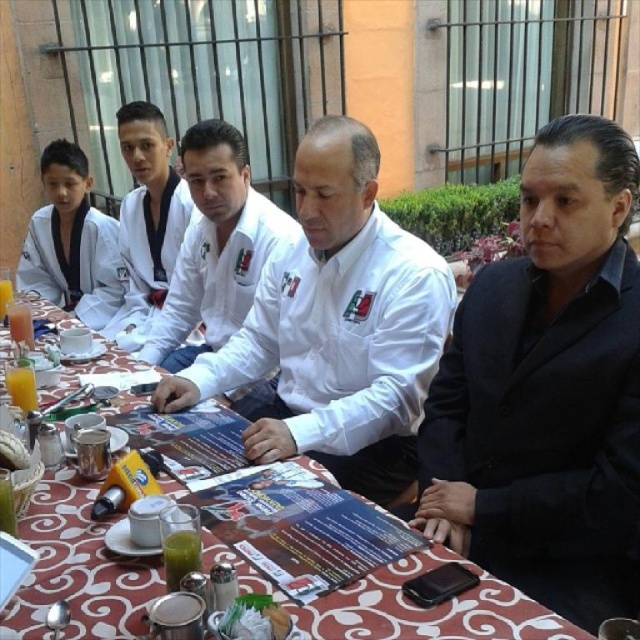
Question: Which point is farther to the camera?

Choices:
 (A) (4, 296)
 (B) (67, 525)
 (C) (364, 234)
 (D) (115, 300)

Answer: (D)

Question: Can you confirm if patterned fabric table at center is smaller than white cotton karate uniform at left?

Choices:
 (A) no
 (B) yes

Answer: (B)

Question: Does black smooth suit at right have a smaller size compared to white cotton karate uniform at left?

Choices:
 (A) yes
 (B) no

Answer: (B)

Question: Is translucent glass juice at table left positioned before orange liquid at table left?

Choices:
 (A) yes
 (B) no

Answer: (A)

Question: Which object is the farthest from the white cotton karate uniform at left?

Choices:
 (A) white matte shirt at center
 (B) black smooth suit at right

Answer: (B)

Question: Which point appears closest to the camera in this image?

Choices:
 (A) pyautogui.click(x=88, y=269)
 (B) pyautogui.click(x=44, y=593)
 (C) pyautogui.click(x=225, y=232)

Answer: (B)